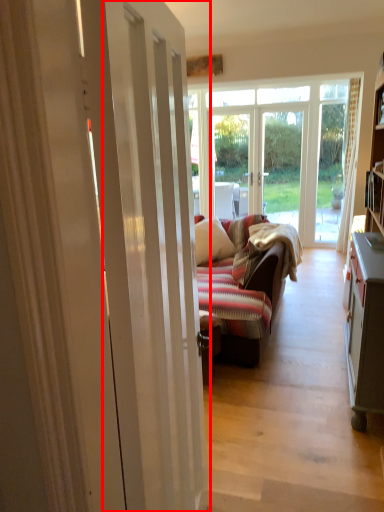
Question: From the image's perspective, considering the relative positions of door (annotated by the red box) and pillow in the image provided, where is door (annotated by the red box) located with respect to the staircase?

Choices:
 (A) above
 (B) below

Answer: (B)